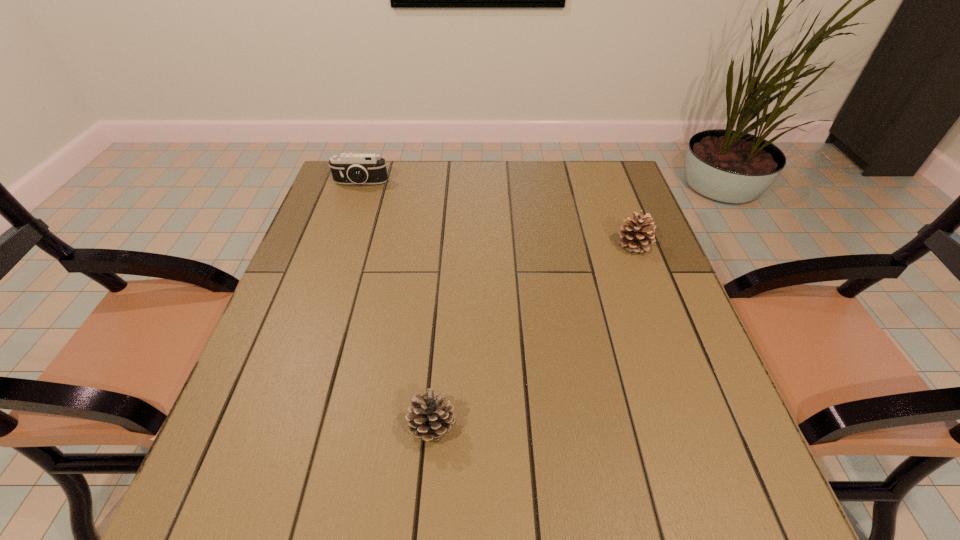
The width and height of the screenshot is (960, 540). Identify the location of the farthest object. (350, 168).

This screenshot has height=540, width=960. I want to click on the leftmost object, so click(350, 168).

Where is `the second nearest object`? the second nearest object is located at coordinates (636, 237).

Locate an element on the screen. The width and height of the screenshot is (960, 540). the rightmost object is located at coordinates (636, 237).

This screenshot has width=960, height=540. What are the coordinates of `the left pinecone` in the screenshot? It's located at (430, 418).

Identify the location of the nearer pinecone. Image resolution: width=960 pixels, height=540 pixels. (430, 418).

I want to click on free space located on the front lens of the farthest object, so click(x=346, y=230).

Where is `vacant space located on the back of the second nearest object`? vacant space located on the back of the second nearest object is located at coordinates (605, 167).

This screenshot has width=960, height=540. I want to click on vacant space located on the right of the second object from left to right, so pyautogui.click(x=516, y=427).

Locate an element on the screen. The image size is (960, 540). object that is positioned at the far edge is located at coordinates (350, 168).